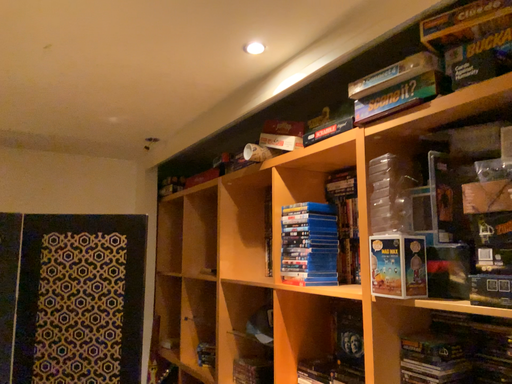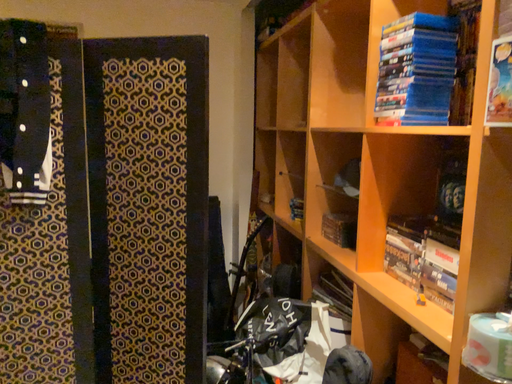
Question: Which way did the camera rotate in the video?

Choices:
 (A) rotated left
 (B) rotated right

Answer: (A)